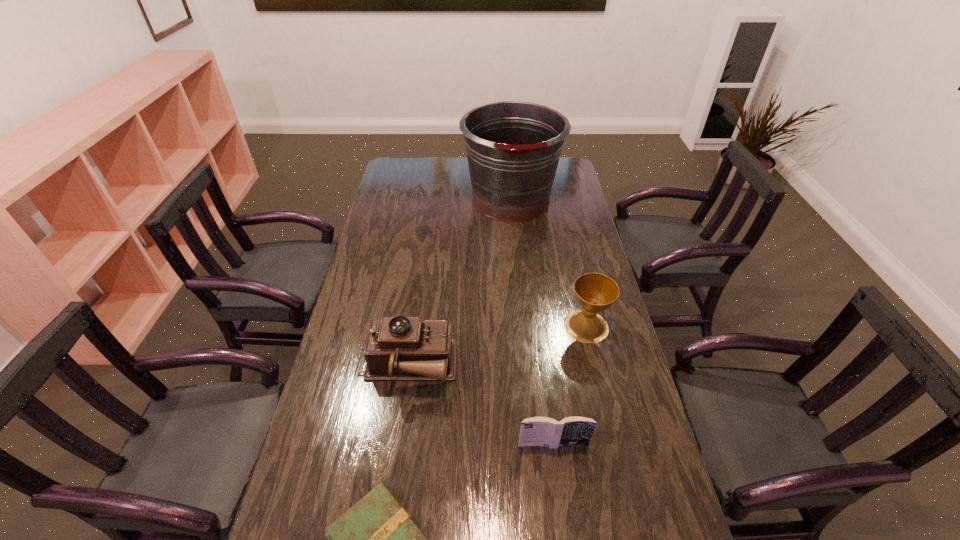
Locate an element on the screen. The height and width of the screenshot is (540, 960). object situated at the far edge is located at coordinates (513, 148).

Find the location of a particular element. The height and width of the screenshot is (540, 960). object located at the left edge is located at coordinates (400, 348).

Image resolution: width=960 pixels, height=540 pixels. In order to click on bucket situated at the right edge in this screenshot , I will do `click(513, 148)`.

Locate an element on the screen. Image resolution: width=960 pixels, height=540 pixels. chalice situated at the right edge is located at coordinates (595, 292).

Where is `book present at the right edge`? The image size is (960, 540). book present at the right edge is located at coordinates (537, 431).

The image size is (960, 540). I want to click on object that is at the far right corner, so click(513, 148).

The height and width of the screenshot is (540, 960). In the image, there is a desktop. In order to click on vacant space at the far edge in this screenshot , I will do `click(440, 174)`.

Find the location of `vacant space at the left edge of the desktop`. vacant space at the left edge of the desktop is located at coordinates (362, 287).

In the image, there is a desktop. Where is `vacant space at the right edge`? vacant space at the right edge is located at coordinates (563, 307).

The image size is (960, 540). I want to click on vacant space at the far left corner of the desktop, so pyautogui.click(x=414, y=171).